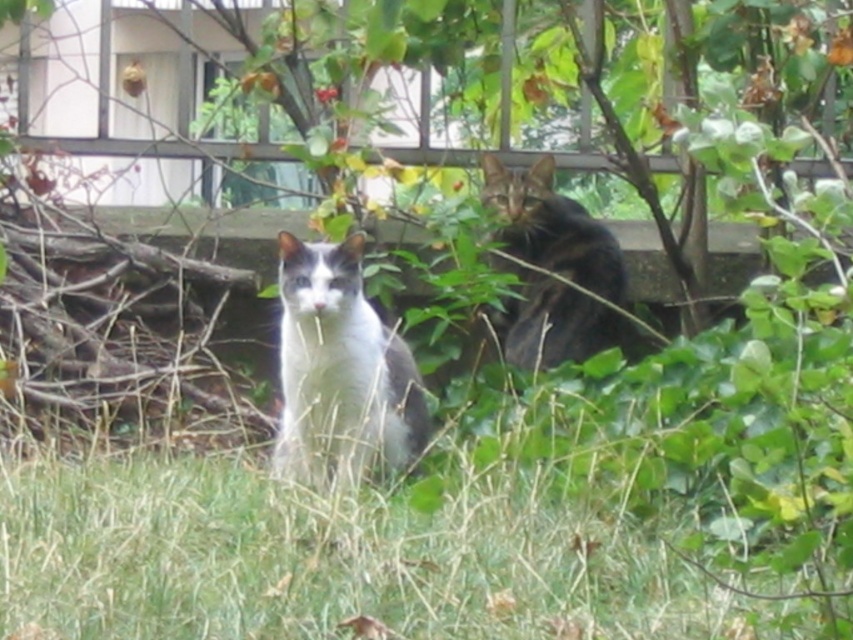
Question: Among these points, which one is nearest to the camera?

Choices:
 (A) (323, 340)
 (B) (618, 289)

Answer: (A)

Question: Does white-furred cat at center have a lesser width compared to tabby fur cat at upper right?

Choices:
 (A) no
 (B) yes

Answer: (B)

Question: Which of the following is the farthest from the observer?

Choices:
 (A) (543, 228)
 (B) (402, 428)

Answer: (A)

Question: Is white-furred cat at center positioned before tabby fur cat at upper right?

Choices:
 (A) yes
 (B) no

Answer: (A)

Question: Is white-furred cat at center behind tabby fur cat at upper right?

Choices:
 (A) no
 (B) yes

Answer: (A)

Question: Among these points, which one is nearest to the camera?

Choices:
 (A) (491, 170)
 (B) (314, 330)

Answer: (B)